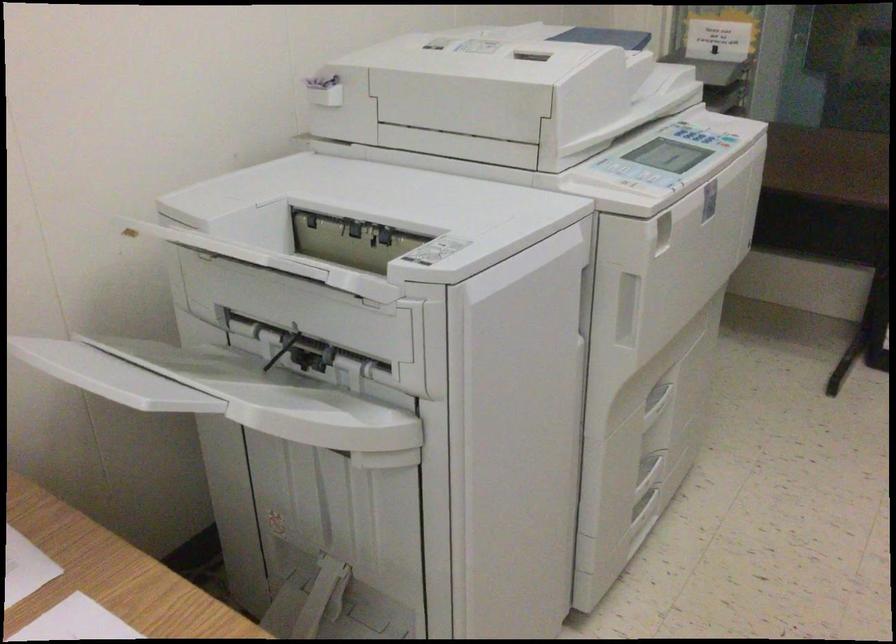
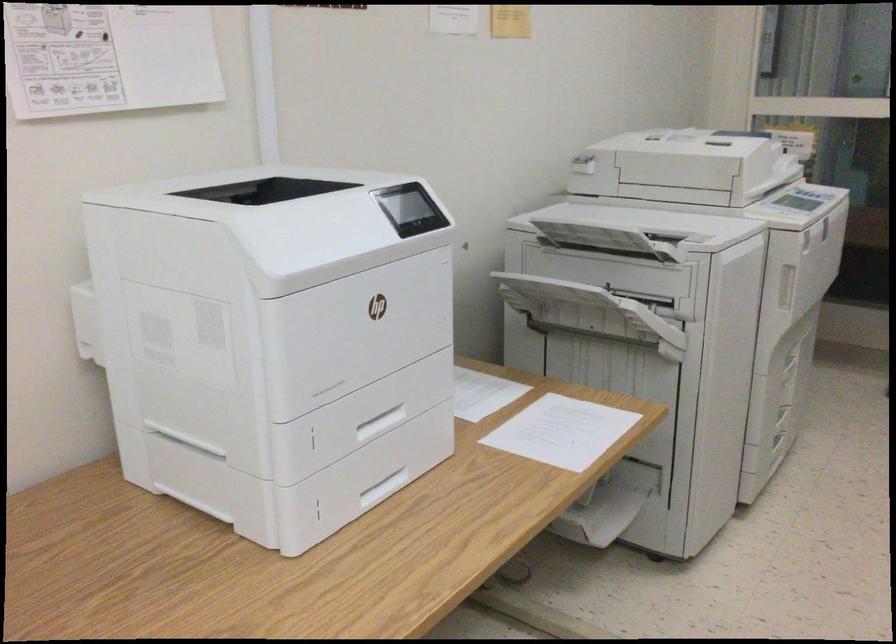
Where in the second image is the point corresponding to the point at 203,408 from the first image?

(601, 301)